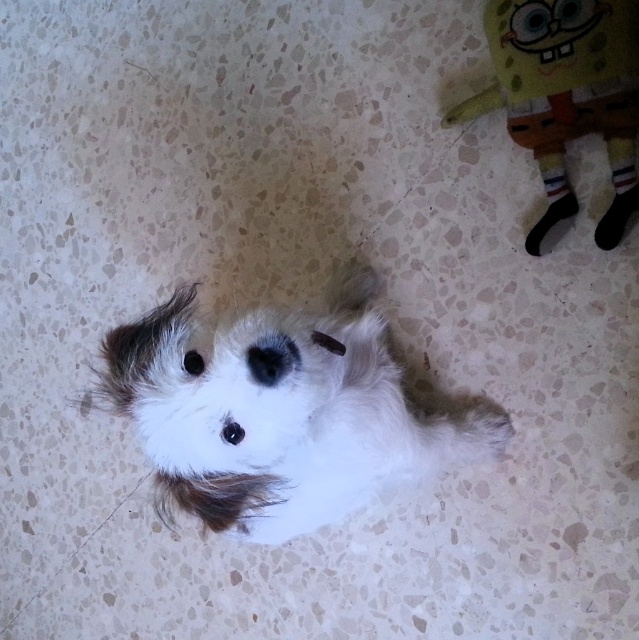
Who is lower down, fluffy white dog at center or yellow plush toy at upper right?

fluffy white dog at center is below.

Based on the photo, can you confirm if fluffy white dog at center is thinner than yellow plush toy at upper right?

In fact, fluffy white dog at center might be wider than yellow plush toy at upper right.

Describe the element at coordinates (282, 412) in the screenshot. I see `fluffy white dog at center` at that location.

Identify the location of fluffy white dog at center. The height and width of the screenshot is (640, 639). (282, 412).